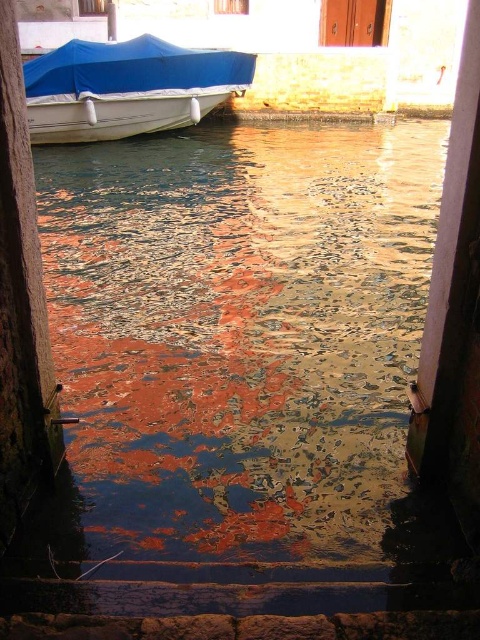
Is reflective water at center taller than blue tarpaulin boat at upper left?

Indeed, reflective water at center has a greater height compared to blue tarpaulin boat at upper left.

Can you confirm if reflective water at center is positioned above blue tarpaulin boat at upper left?

No.

You are a GUI agent. You are given a task and a screenshot of the screen. Output one action in this format:
    pyautogui.click(x=<x>, y=<y>)
    Task: Click on the reflective water at center
    This screenshot has height=640, width=480.
    Given the screenshot: What is the action you would take?
    point(240,333)

Find the location of `reflective water at center`. reflective water at center is located at coordinates (240, 333).